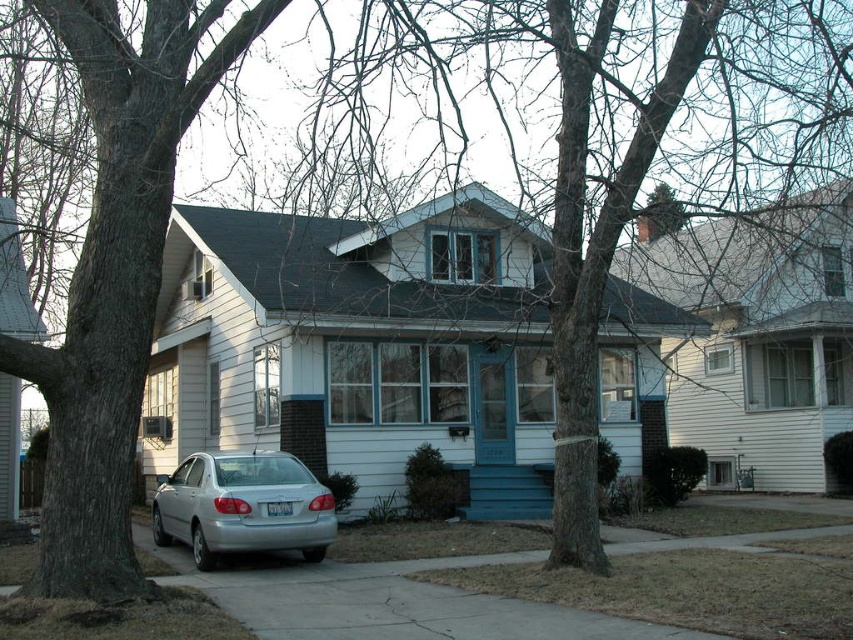
Can you confirm if smooth bark tree at center is positioned below silver metallic sedan at center?

Incorrect, smooth bark tree at center is not positioned below silver metallic sedan at center.

Can you confirm if smooth bark tree at center is smaller than silver metallic sedan at center?

No.

Where is `smooth bark tree at center`? The width and height of the screenshot is (853, 640). smooth bark tree at center is located at coordinates (776, 67).

At what (x,y) coordinates should I click in order to perform the action: click on smooth gray bark at left. Please return your answer as a coordinate pair (x, y). This screenshot has width=853, height=640. Looking at the image, I should click on (115, 276).

Which of these two, smooth gray bark at left or silver metallic sedan at center, stands shorter?

silver metallic sedan at center

At what (x,y) coordinates should I click in order to perform the action: click on smooth gray bark at left. Please return your answer as a coordinate pair (x, y). This screenshot has height=640, width=853. Looking at the image, I should click on (115, 276).

Is point (76, 376) behind point (538, 58)?

No, it is not.

Which of these two, smooth gray bark at left or smooth bark tree at center, stands taller?

smooth bark tree at center is taller.

Is point (67, 330) closer to viewer compared to point (627, 148)?

Yes.

Where is `smooth gray bark at left`? The image size is (853, 640). smooth gray bark at left is located at coordinates (115, 276).